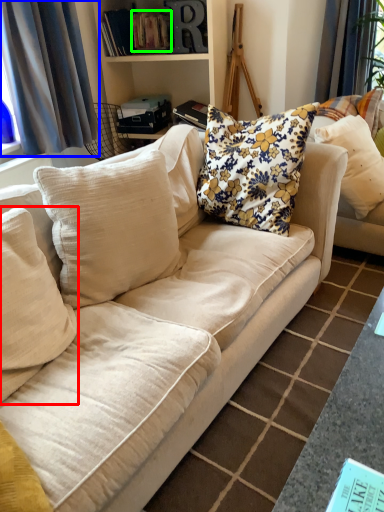
Question: Estimate the real-world distances between objects in this image. Which object is farther from pillow (highlighted by a red box), curtain (highlighted by a blue box) or book (highlighted by a green box)?

Choices:
 (A) curtain
 (B) book

Answer: (B)